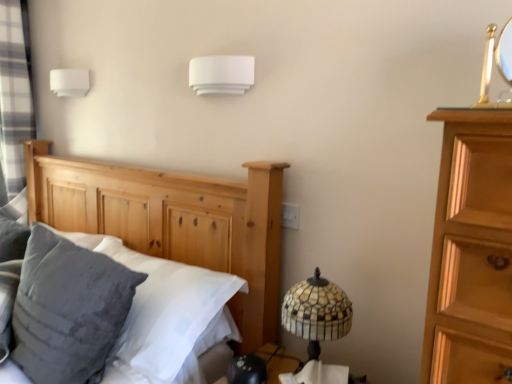
Question: Would you say gray plaid curtain at left is a long distance from white matte wall light at upper center, the 2th lamp in the left-to-right sequence?

Choices:
 (A) no
 (B) yes

Answer: (B)

Question: Does gray plaid curtain at left touch white matte wall light at upper center, the 2th lamp in the left-to-right sequence?

Choices:
 (A) no
 (B) yes

Answer: (A)

Question: Is gray plaid curtain at left oriented away from white matte wall light at upper center, arranged as the 1th lamp when viewed from the front?

Choices:
 (A) yes
 (B) no

Answer: (B)

Question: Can you confirm if gray plaid curtain at left is taller than white matte wall light at upper center, which ranks as the 1th lamp in right-to-left order?

Choices:
 (A) no
 (B) yes

Answer: (B)

Question: Can you confirm if gray plaid curtain at left is wider than white matte wall light at upper center, which appears as the second lamp when viewed from the back?

Choices:
 (A) yes
 (B) no

Answer: (A)

Question: Is the depth of gray plaid curtain at left greater than that of white matte wall light at upper center, the 2th lamp in the left-to-right sequence?

Choices:
 (A) yes
 (B) no

Answer: (A)

Question: From the image's perspective, would you say white plastic electric outlet at center is shown under white matte rectangular object at upper left, the 1th lamp when ordered from left to right?

Choices:
 (A) no
 (B) yes

Answer: (B)

Question: Does white plastic electric outlet at center appear on the right side of white matte rectangular object at upper left, acting as the 1th lamp starting from the back?

Choices:
 (A) yes
 (B) no

Answer: (A)

Question: Considering the relative sizes of white plastic electric outlet at center and white matte rectangular object at upper left, marked as the 2th lamp in a right-to-left arrangement, in the image provided, is white plastic electric outlet at center shorter than white matte rectangular object at upper left, marked as the 2th lamp in a right-to-left arrangement,?

Choices:
 (A) yes
 (B) no

Answer: (A)

Question: Is white plastic electric outlet at center smaller than white matte rectangular object at upper left, marked as the 2th lamp in a right-to-left arrangement?

Choices:
 (A) no
 (B) yes

Answer: (B)

Question: From a real-world perspective, does white plastic electric outlet at center sit lower than white matte rectangular object at upper left, acting as the 1th lamp starting from the back?

Choices:
 (A) yes
 (B) no

Answer: (A)

Question: Is white plastic electric outlet at center oriented towards white matte rectangular object at upper left, arranged as the second lamp when viewed from the front?

Choices:
 (A) no
 (B) yes

Answer: (A)

Question: From the image's perspective, would you say gray plaid curtain at left is shown under white matte rectangular object at upper left, arranged as the second lamp when viewed from the front?

Choices:
 (A) no
 (B) yes

Answer: (B)